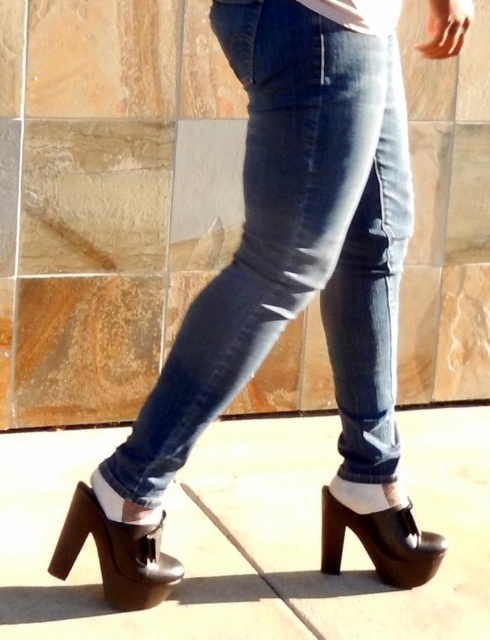
Which is behind, point (298, 22) or point (129, 536)?

The point (129, 536) is behind.

Locate an element on the screen. This screenshot has height=640, width=490. denim at center is located at coordinates (295, 243).

The width and height of the screenshot is (490, 640). What do you see at coordinates (295, 243) in the screenshot?
I see `denim at center` at bounding box center [295, 243].

You are a GUI agent. You are given a task and a screenshot of the screen. Output one action in this format:
    pyautogui.click(x=<x>, y=<y>)
    Task: Click on the denim at center
    The image size is (490, 640).
    Given the screenshot: What is the action you would take?
    pyautogui.click(x=295, y=243)

Is denim at center closer to the viewer compared to brown concrete pavement at lower center?

Yes, denim at center is closer to the viewer.

Is point (296, 100) in front of point (309, 636)?

Yes, it is in front of point (309, 636).

The height and width of the screenshot is (640, 490). In order to click on denim at center in this screenshot , I will do `click(295, 243)`.

Is point (175, 582) less distant than point (323, 566)?

Yes, it is.

Between point (116, 602) and point (431, 545), which one is positioned behind?

The point (431, 545) is more distant.

Does point (102, 579) come farther from viewer compared to point (395, 576)?

No.

The height and width of the screenshot is (640, 490). I want to click on black leather sandal at lower center, so click(x=117, y=554).